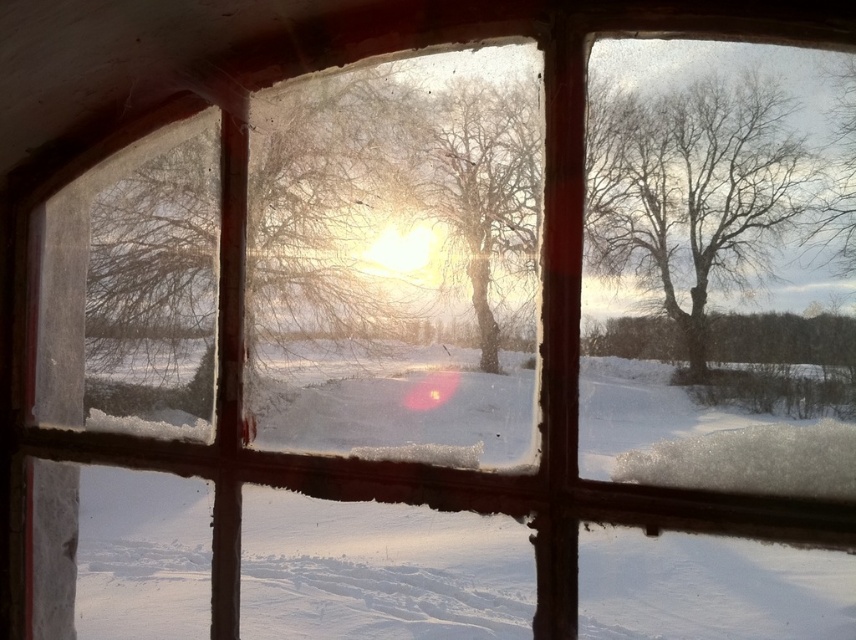
You are an architect designing a new building and want to ensure that the sunlight reaches the garden below the window. Based on the image, where is the position of the bare branches at center relative to the window panes?

The bare branches at center are positioned at coordinates point (693,192), which means they are located near the lower part of the window, potentially blocking some sunlight from reaching the garden below. To allow more sunlight, consider adjusting the branch placement or window design.

You are standing in a room with a window that has a red frame. You notice a point at coordinate [321,214] on the window. What object is located at that coordinate?

The point at coordinate [321,214] corresponds to the translucent frosted glass tree at center.